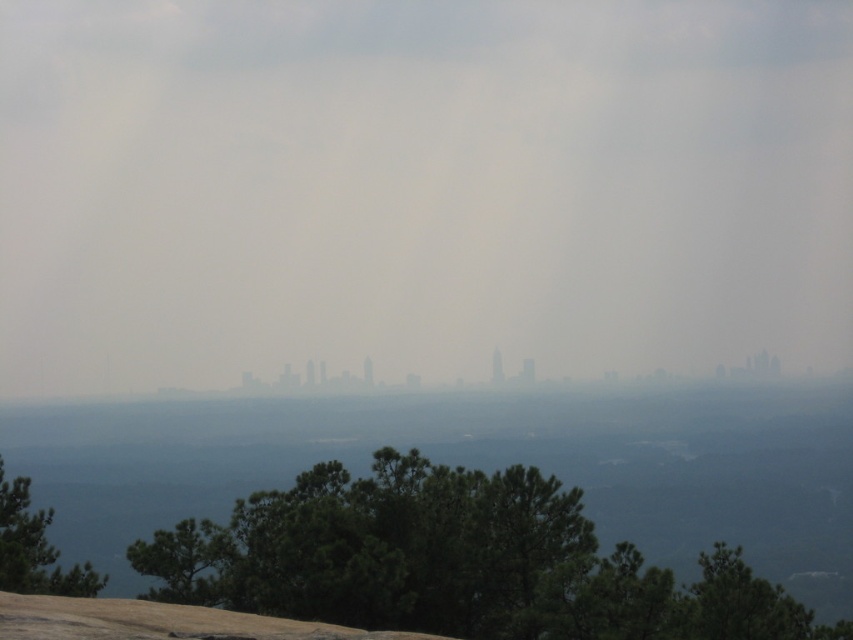
Can you confirm if foggy sky at center is smaller than green leafy tree at lower center?

No.

Is point (21, 346) positioned before point (503, 492)?

No, (21, 346) is behind (503, 492).

I want to click on foggy sky at center, so click(x=419, y=188).

Who is positioned more to the right, green leafy tree at lower center or green matte tree at lower left?

green leafy tree at lower center

Is green leafy tree at lower center shorter than green matte tree at lower left?

Indeed, green leafy tree at lower center has a lesser height compared to green matte tree at lower left.

Which is behind, point (462, 609) or point (24, 544)?

Positioned behind is point (462, 609).

Identify the location of green leafy tree at lower center. Image resolution: width=853 pixels, height=640 pixels. (456, 561).

Does foggy sky at center appear over green matte tree at lower left?

Correct, foggy sky at center is located above green matte tree at lower left.

Between foggy sky at center and green matte tree at lower left, which one has less height?

green matte tree at lower left is shorter.

Is point (488, 172) closer to camera compared to point (90, 588)?

No.

The image size is (853, 640). I want to click on foggy sky at center, so click(419, 188).